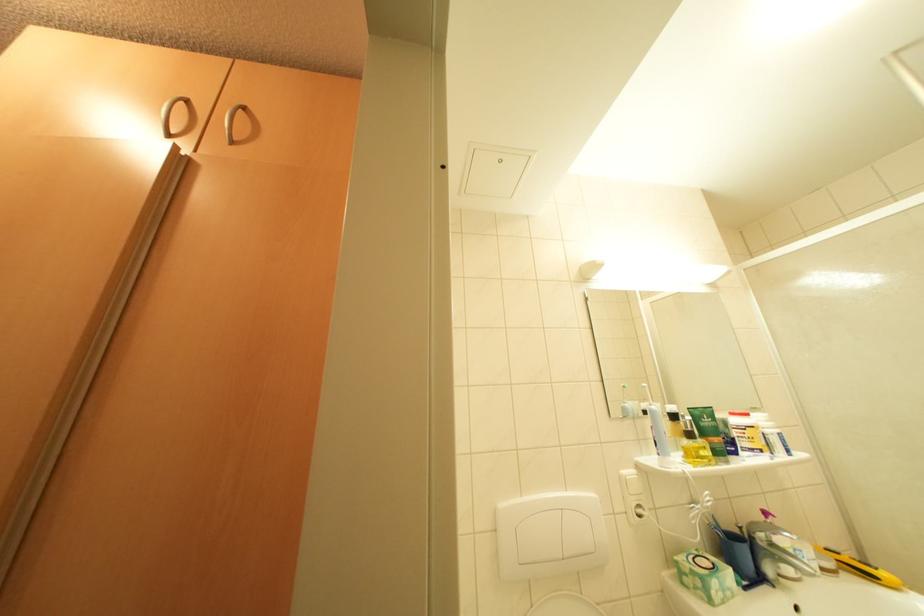
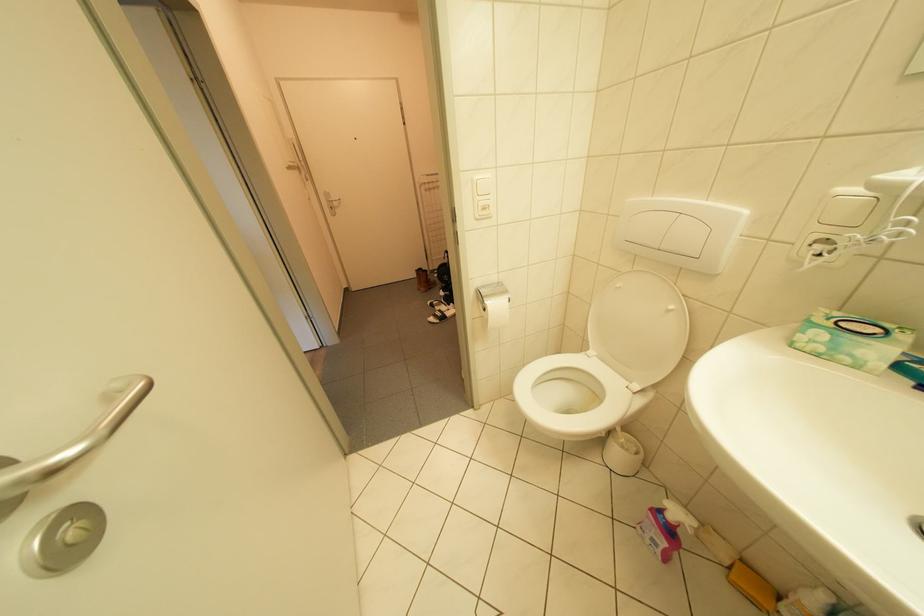
The first image is from the beginning of the video and the second image is from the end. How did the camera likely rotate when shooting the video?

The rotation direction of the camera is left-down.